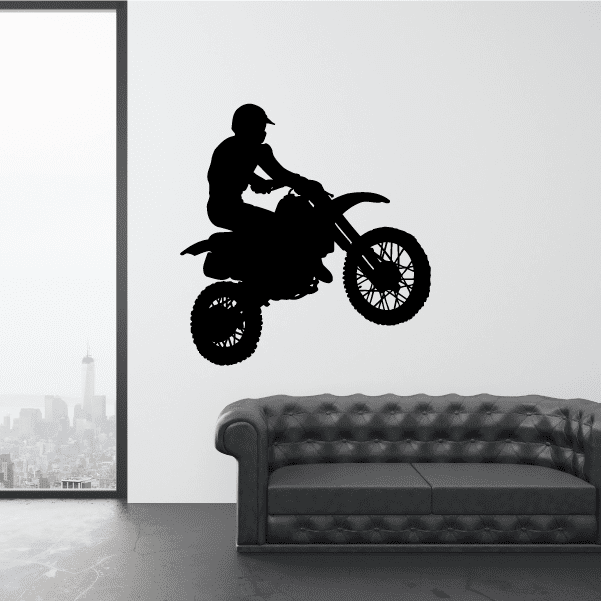
Find the location of `couch cushions`. couch cushions is located at coordinates (379, 477), (499, 478).